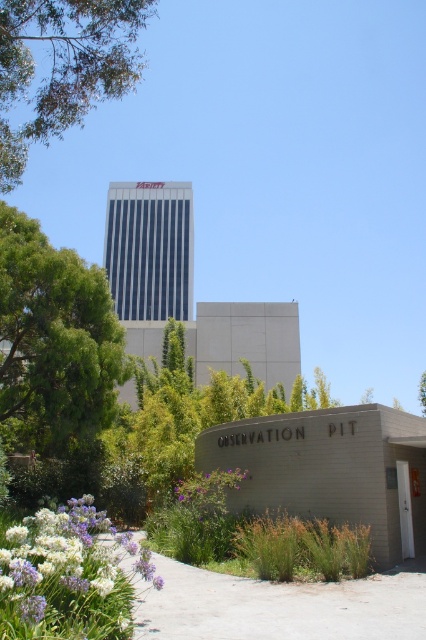
Describe the element at coordinates (54, 340) in the screenshot. The height and width of the screenshot is (640, 426). I see `green leafy tree at left` at that location.

Who is positioned more to the left, green leafy tree at left or green leafy tree at upper center?

Positioned to the left is green leafy tree at left.

Locate an element on the screen. Image resolution: width=426 pixels, height=640 pixels. green leafy tree at left is located at coordinates (54, 340).

Between point (83, 67) and point (37, 516), which one is positioned in front?

Point (37, 516)

Can you confirm if green leafy tree at upper center is bigger than white matte flowers at lower left?

Indeed, green leafy tree at upper center has a larger size compared to white matte flowers at lower left.

Identify the location of green leafy tree at upper center. This screenshot has width=426, height=640. (63, 67).

Where is `green leafy tree at upper center`? This screenshot has height=640, width=426. green leafy tree at upper center is located at coordinates (63, 67).

Who is positioned more to the right, green leafy tree at left or purple matte flower at lower center?

Positioned to the right is purple matte flower at lower center.

How much distance is there between green leafy tree at left and purple matte flower at lower center?

green leafy tree at left is 6.16 meters away from purple matte flower at lower center.

Identify the location of green leafy tree at left. The height and width of the screenshot is (640, 426). pyautogui.click(x=54, y=340).

At what (x,y) coordinates should I click in order to perform the action: click on green leafy tree at left. Please return your answer as a coordinate pair (x, y). The height and width of the screenshot is (640, 426). Looking at the image, I should click on (54, 340).